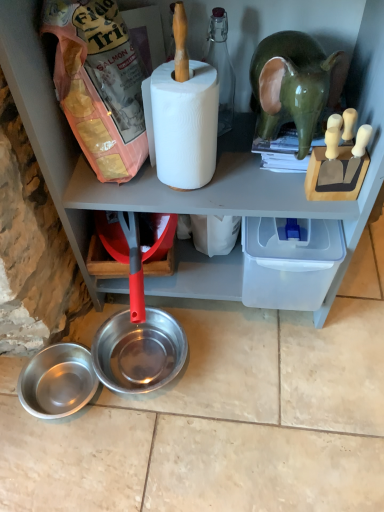
Find the location of a particular element. This screenshot has width=384, height=512. vacant space to the right of shiny metallic bowl at lower center, the 1th bowl when ordered from right to left is located at coordinates (233, 370).